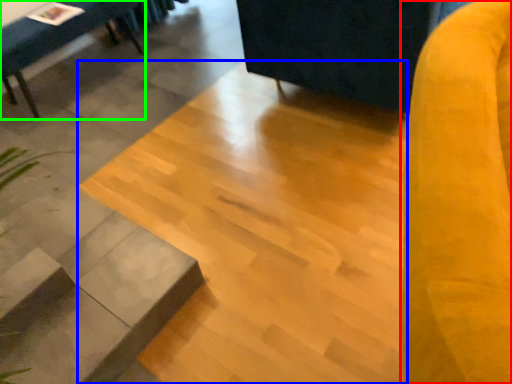
Question: Considering the real-world distances, which object is closest to swivel chair (highlighted by a red box)? concrete (highlighted by a blue box) or furniture (highlighted by a green box).

Choices:
 (A) concrete
 (B) furniture

Answer: (A)